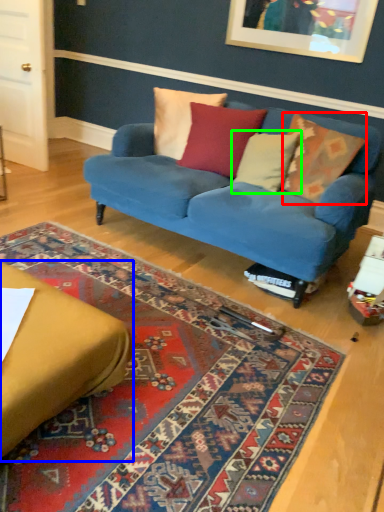
Question: Which object is positioned farthest from pillow (highlighted by a red box)? Select from studio couch (highlighted by a blue box) and pillow (highlighted by a green box).

Choices:
 (A) studio couch
 (B) pillow

Answer: (A)